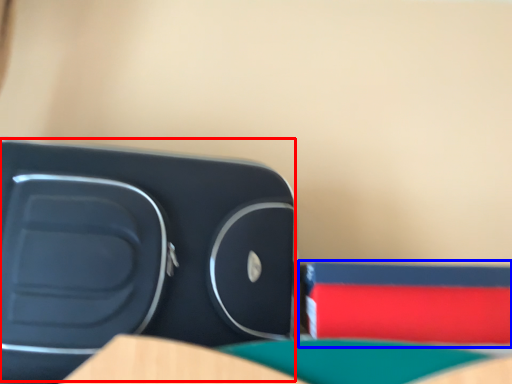
Question: Which point is further to the camera, turquoise (highlighted by a red box) or paperback book (highlighted by a blue box)?

Choices:
 (A) turquoise
 (B) paperback book

Answer: (B)